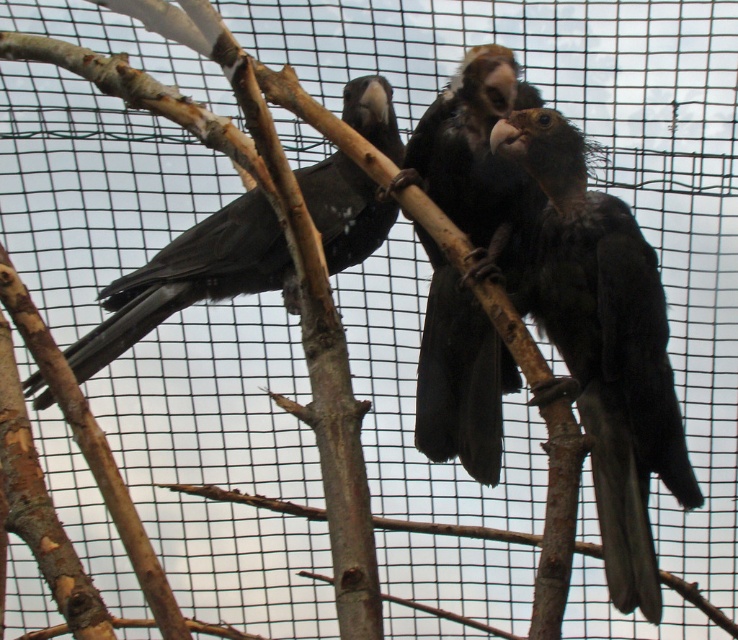
Question: Can you confirm if shiny black parrot at center is thinner than black feathers at center?

Choices:
 (A) no
 (B) yes

Answer: (A)

Question: Which point appears closest to the camera in this image?

Choices:
 (A) (679, 433)
 (B) (337, 250)
 (C) (500, 72)

Answer: (C)

Question: Which of the following is the closest to the observer?

Choices:
 (A) (582, 298)
 (B) (201, 225)
 (C) (517, 211)

Answer: (A)

Question: Does shiny black parrot at center appear on the left side of matte black bird at center?

Choices:
 (A) no
 (B) yes

Answer: (A)

Question: Considering the real-world distances, which object is closest to the matte black bird at center?

Choices:
 (A) black feathers at center
 (B) shiny black parrot at center

Answer: (A)

Question: Does shiny black parrot at center appear on the right side of black feathers at center?

Choices:
 (A) yes
 (B) no

Answer: (A)